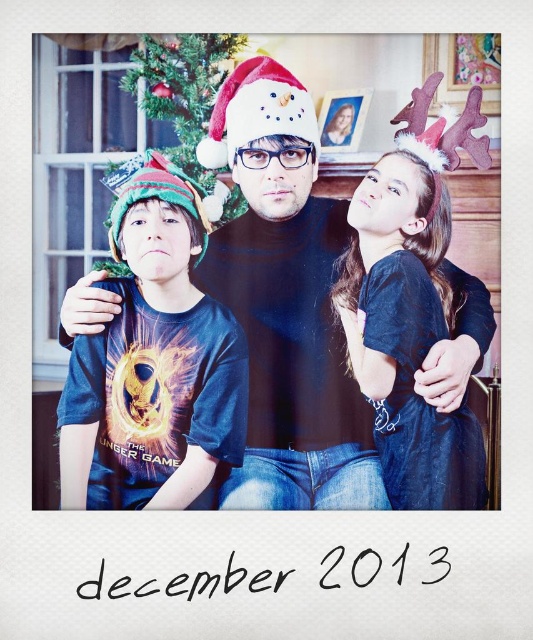
Can you confirm if black matte santa hat at center is taller than white matte santa hat at center?

Yes.

Measure the distance between point (308, 481) and camera.

Point (308, 481) and camera are 4.88 feet apart.

This screenshot has height=640, width=533. Identify the location of black matte santa hat at center. (286, 301).

Does point (474, 125) come closer to viewer compared to point (146, 451)?

Yes, it is in front of point (146, 451).

Does black matte santa hat at center appear under blue t-shirt at left?

Incorrect, black matte santa hat at center is not positioned below blue t-shirt at left.

What do you see at coordinates (286, 301) in the screenshot?
I see `black matte santa hat at center` at bounding box center [286, 301].

The image size is (533, 640). What are the coordinates of `black matte santa hat at center` in the screenshot? It's located at (286, 301).

Is point (415, 369) less distant than point (224, 81)?

Yes, point (415, 369) is closer to viewer.

Is dark blue denim jeans at lower right taller than white matte santa hat at center?

Indeed, dark blue denim jeans at lower right has a greater height compared to white matte santa hat at center.

What do you see at coordinates (405, 337) in the screenshot?
I see `dark blue denim jeans at lower right` at bounding box center [405, 337].

Image resolution: width=533 pixels, height=640 pixels. Find the location of `dark blue denim jeans at lower right`. dark blue denim jeans at lower right is located at coordinates (405, 337).